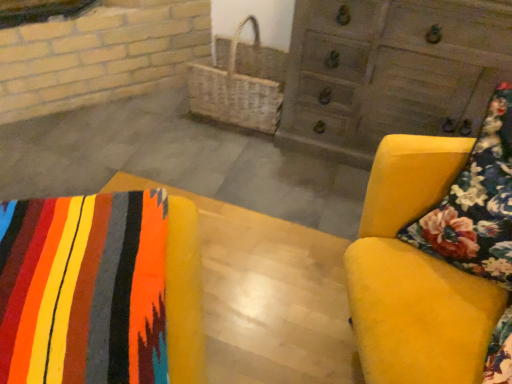
The image size is (512, 384). What are the coordinates of `free space on the front side of woven wicker basket at center` in the screenshot? It's located at (230, 159).